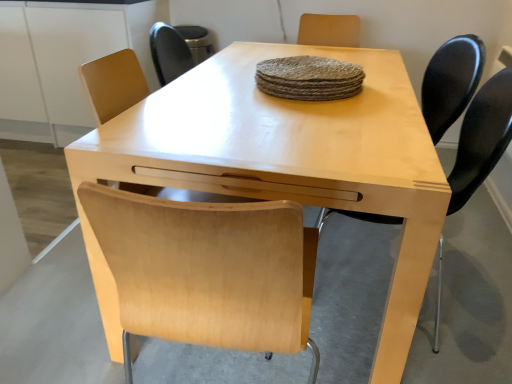
Locate an element on the screen. This screenshot has width=512, height=384. vacant space situated above light wood table at center (from a real-world perspective) is located at coordinates (286, 96).